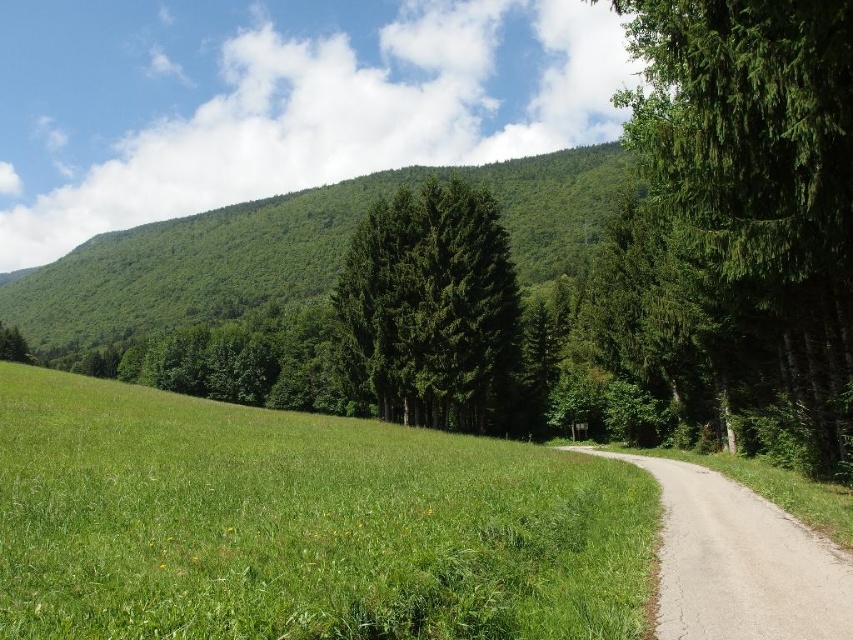
Question: Which object is positioned farthest from the green matte tree at center?

Choices:
 (A) green textured tree at right
 (B) green leafy hillside at upper left
 (C) gray gravel path at center-right

Answer: (B)

Question: In this image, where is green grassy field at center located relative to green leafy hillside at upper left?

Choices:
 (A) below
 (B) above

Answer: (A)

Question: Which point appears farthest from the camera in this image?

Choices:
 (A) (67, 592)
 (B) (202, 316)
 (C) (756, 564)

Answer: (B)

Question: Does green leafy hillside at upper left have a greater width compared to gray gravel path at center-right?

Choices:
 (A) yes
 (B) no

Answer: (A)

Question: Can you confirm if green leafy hillside at upper left is thinner than green matte tree at center?

Choices:
 (A) yes
 (B) no

Answer: (B)

Question: Which point is closer to the camera taking this photo?

Choices:
 (A) (514, 362)
 (B) (21, 435)
 (C) (305, 280)

Answer: (B)